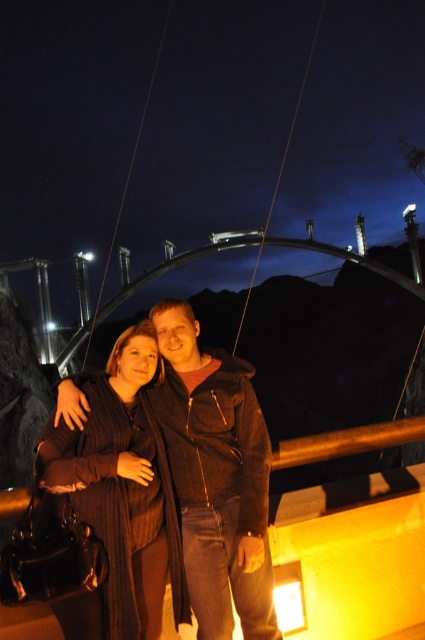
You are a photographer trying to capture a group photo of two people wearing a dark brown jacket at center and a knitted sweater at center. The minimum distance required for your camera to focus clearly is 10 feet. Can you take the photo without moving either subject?

The distance between the dark brown jacket at center and the knitted sweater at center is 11.69 feet, which exceeds the camera minimum focusing distance of 10 feet. Therefore, the camera can focus clearly on both subjects without needing to move them.

You are a photographer trying to capture the perfect shot of the dark brown jacket at center and the knitted sweater at center. Based on their positions, which clothing item is positioned higher in the frame?

The dark brown jacket at center is located above the knitted sweater at center, so it is positioned higher in the frame.

You are a photographer trying to capture a clear shot of both the dark brown jacket at center and the knitted sweater at center. Based on their positions, which one might be more challenging to fully capture in the frame due to its position relative to the other?

The knitted sweater at center is behind the dark brown jacket at center, so it might be more challenging to fully capture the knitted sweater at center in the frame because it is obscured by the dark brown jacket at center.